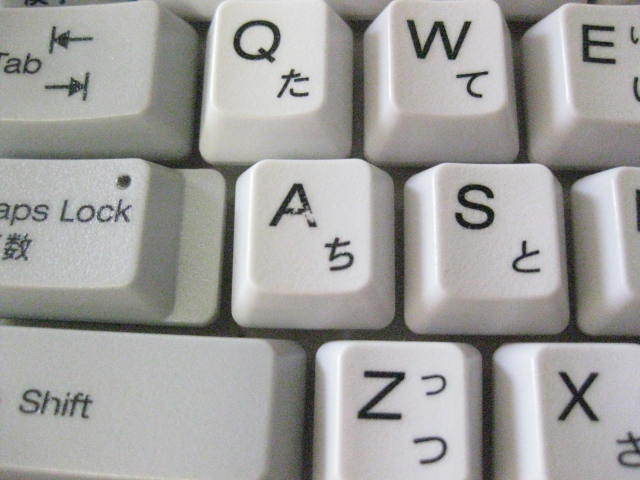
The width and height of the screenshot is (640, 480). I want to click on computer, so click(x=361, y=273).